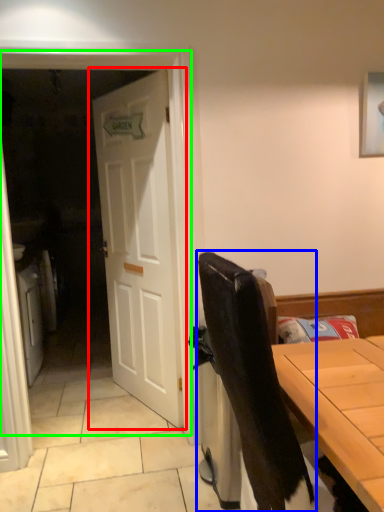
Question: Estimate the real-world distances between objects in this image. Which object is farther from door (highlighted by a red box), chair (highlighted by a blue box) or screen door (highlighted by a green box)?

Choices:
 (A) chair
 (B) screen door

Answer: (A)